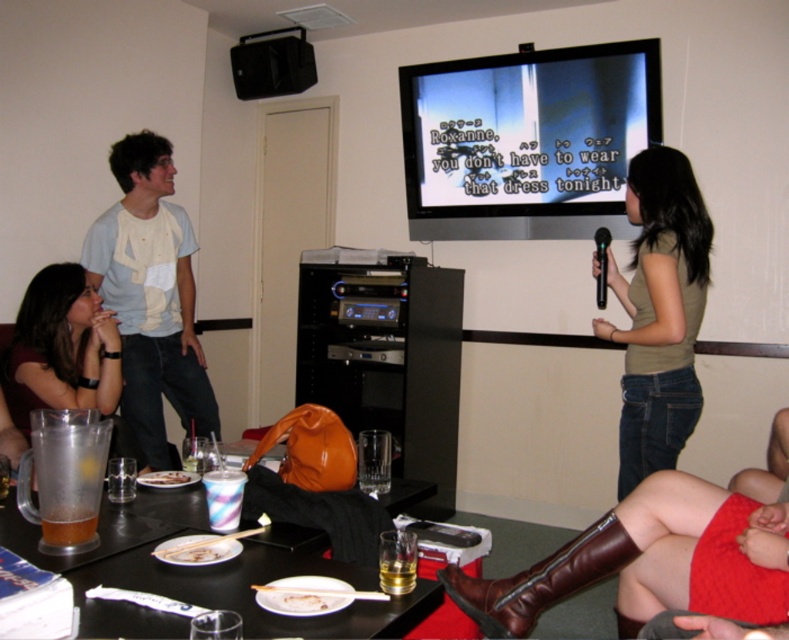
Is orange leather entertainment center at center behind white cotton shirt at upper left?

That is True.

Which is behind, point (324, 352) or point (163, 291)?

Positioned behind is point (324, 352).

What do you see at coordinates (387, 358) in the screenshot?
I see `orange leather entertainment center at center` at bounding box center [387, 358].

Identify the location of orange leather entertainment center at center. (387, 358).

Is translucent plastic cups at lower center above white cotton shirt at upper left?

Actually, translucent plastic cups at lower center is below white cotton shirt at upper left.

Does translucent plastic cups at lower center have a smaller size compared to white cotton shirt at upper left?

Correct, translucent plastic cups at lower center occupies less space than white cotton shirt at upper left.

At what (x,y) coordinates should I click in order to perform the action: click on translucent plastic cups at lower center. Please return your answer as a coordinate pair (x, y). Looking at the image, I should click on (223, 568).

The height and width of the screenshot is (640, 789). I want to click on black plastic speaker at upper left, so click(x=271, y=67).

Is black plastic speaker at upper left positioned behind black plastic microphone at upper right?

Yes, black plastic speaker at upper left is behind black plastic microphone at upper right.

This screenshot has width=789, height=640. I want to click on black plastic speaker at upper left, so click(271, 67).

Where is `black plastic speaker at upper left`? The width and height of the screenshot is (789, 640). black plastic speaker at upper left is located at coordinates (271, 67).